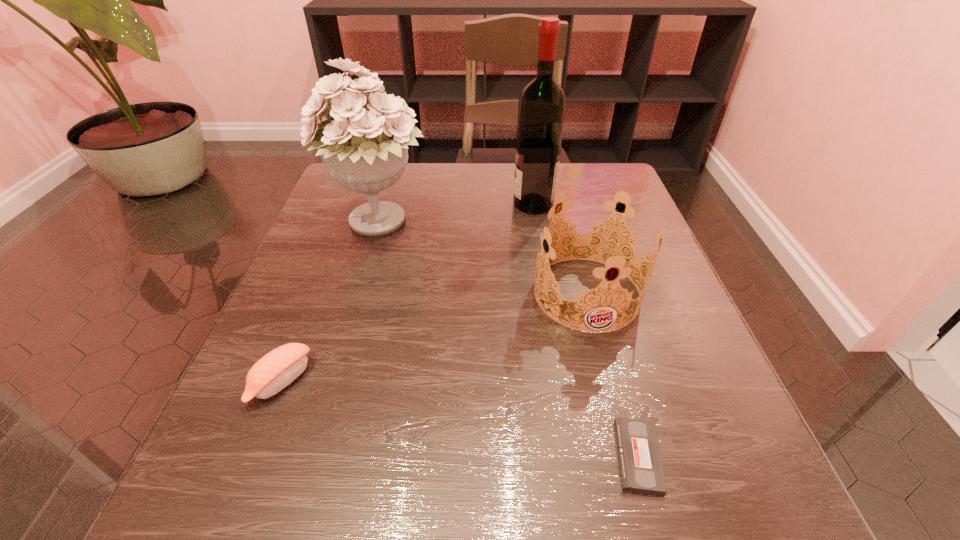
I want to click on alcohol, so click(541, 111).

At what (x,y) coordinates should I click in order to perform the action: click on bouquet. Please return your answer as a coordinate pair (x, y). Looking at the image, I should click on (364, 150).

In order to click on the third tallest object in this screenshot , I will do `click(598, 246)`.

Find the location of a particular element. Image resolution: width=960 pixels, height=540 pixels. crown is located at coordinates (598, 246).

Where is `sushi`? This screenshot has width=960, height=540. sushi is located at coordinates (277, 369).

Where is `the second nearest object`? The image size is (960, 540). the second nearest object is located at coordinates (277, 369).

Find the location of a particular element. videotape is located at coordinates (641, 471).

Where is `the shortest object`? The image size is (960, 540). the shortest object is located at coordinates (641, 471).

The height and width of the screenshot is (540, 960). Identify the location of free space located 0.340m on the front and back of the alcohol. (365, 204).

What are the coordinates of `free space located on the front and back of the alcohol` in the screenshot? It's located at click(469, 204).